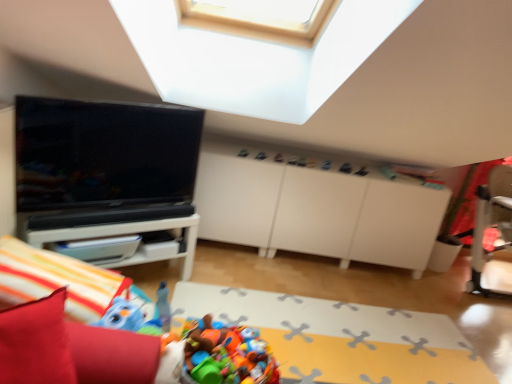
Question: Which direction should I rotate to look at matte plastic toy at upper center, which ranks as the second toy in left-to-right order?

Choices:
 (A) right
 (B) left

Answer: (A)

Question: Is matte black tv at left further to the viewer compared to plastic toy basket at lower center?

Choices:
 (A) no
 (B) yes

Answer: (A)

Question: Are matte black tv at left and plastic toy basket at lower center located far from each other?

Choices:
 (A) no
 (B) yes

Answer: (B)

Question: Is matte black tv at left positioned before plastic toy basket at lower center?

Choices:
 (A) no
 (B) yes

Answer: (B)

Question: Is matte black tv at left outside plastic toy basket at lower center?

Choices:
 (A) no
 (B) yes

Answer: (B)

Question: Considering the relative sizes of matte black tv at left and plastic toy basket at lower center in the image provided, is matte black tv at left wider than plastic toy basket at lower center?

Choices:
 (A) no
 (B) yes

Answer: (A)

Question: Does matte black tv at left touch plastic toy basket at lower center?

Choices:
 (A) yes
 (B) no

Answer: (B)

Question: Does white matte dresser at center lie behind red fabric bean bag chair at lower left?

Choices:
 (A) yes
 (B) no

Answer: (A)

Question: From the image's perspective, would you say white matte dresser at center is shown under red fabric bean bag chair at lower left?

Choices:
 (A) no
 (B) yes

Answer: (A)

Question: Is white matte dresser at center touching red fabric bean bag chair at lower left?

Choices:
 (A) no
 (B) yes

Answer: (A)

Question: Is white matte dresser at center shorter than red fabric bean bag chair at lower left?

Choices:
 (A) yes
 (B) no

Answer: (B)

Question: Does white matte dresser at center turn towards red fabric bean bag chair at lower left?

Choices:
 (A) no
 (B) yes

Answer: (B)

Question: Considering the relative positions of white matte dresser at center and red fabric bean bag chair at lower left in the image provided, is white matte dresser at center in front of red fabric bean bag chair at lower left?

Choices:
 (A) yes
 (B) no

Answer: (B)

Question: Would you say matte black toy at upper center, the 3th toy when ordered from left to right, is outside white glossy table at left?

Choices:
 (A) no
 (B) yes

Answer: (B)